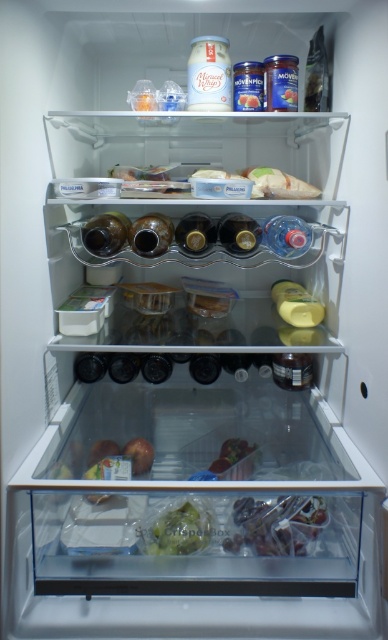
You are organizing the fridge and need to access the shiny plastic container at center. Is the green matte crisper box at lower center blocking your way?

The green matte criser box at lower center is in front of the shiny plastic container at center, so yes, it is blocking the way.

You are organizing the contents of the refrigerator and need to place a new item that requires more space. Which object in the refrigerator can accommodate a larger item between the translucent plastic bag at lower center and the shiny plastic container at center?

The translucent plastic bag at lower center has a larger size compared to the shiny plastic container at center, so it can accommodate a larger item.